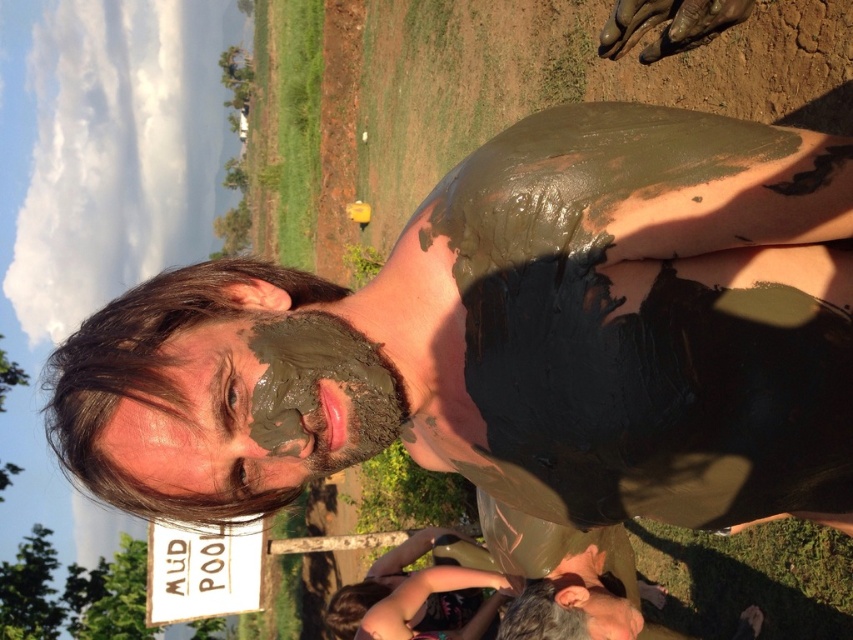
Is matte mud face at center above muddy clay face at center?

Correct, matte mud face at center is located above muddy clay face at center.

Which is above, matte mud face at center or muddy clay face at center?

Positioned higher is matte mud face at center.

What do you see at coordinates (514, 339) in the screenshot? The image size is (853, 640). I see `matte mud face at center` at bounding box center [514, 339].

I want to click on matte mud face at center, so click(x=514, y=339).